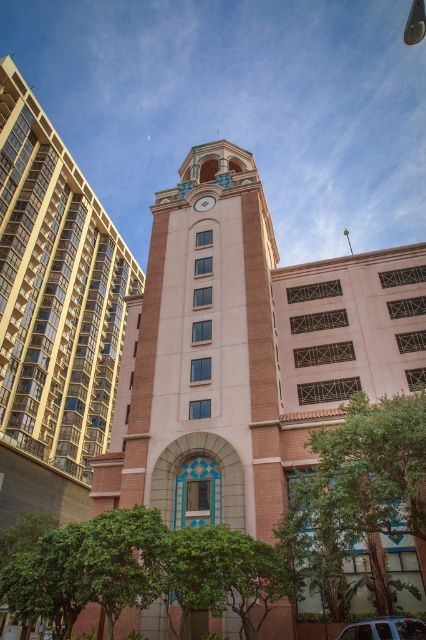
Is brick clock tower at center to the right of metallic silver car at center from the viewer's perspective?

In fact, brick clock tower at center is to the left of metallic silver car at center.

Is point (172, 195) positioned in front of point (417, 632)?

No, it is behind (417, 632).

This screenshot has height=640, width=426. Find the location of `brick clock tower at center`. brick clock tower at center is located at coordinates (204, 358).

Does beige brick clock tower at center appear on the right side of green leafy tree at lower right?

Incorrect, beige brick clock tower at center is not on the right side of green leafy tree at lower right.

Who is positioned more to the right, beige brick clock tower at center or green leafy tree at lower right?

green leafy tree at lower right

Find the location of a particular element. The width and height of the screenshot is (426, 640). beige brick clock tower at center is located at coordinates (55, 292).

Can you confirm if brick clock tower at center is positioned below matte gold clock at center?

Indeed, brick clock tower at center is positioned under matte gold clock at center.

Between point (132, 301) and point (203, 202), which one is positioned behind?

The point (132, 301) is more distant.

Where is `brick clock tower at center`? brick clock tower at center is located at coordinates (204, 358).